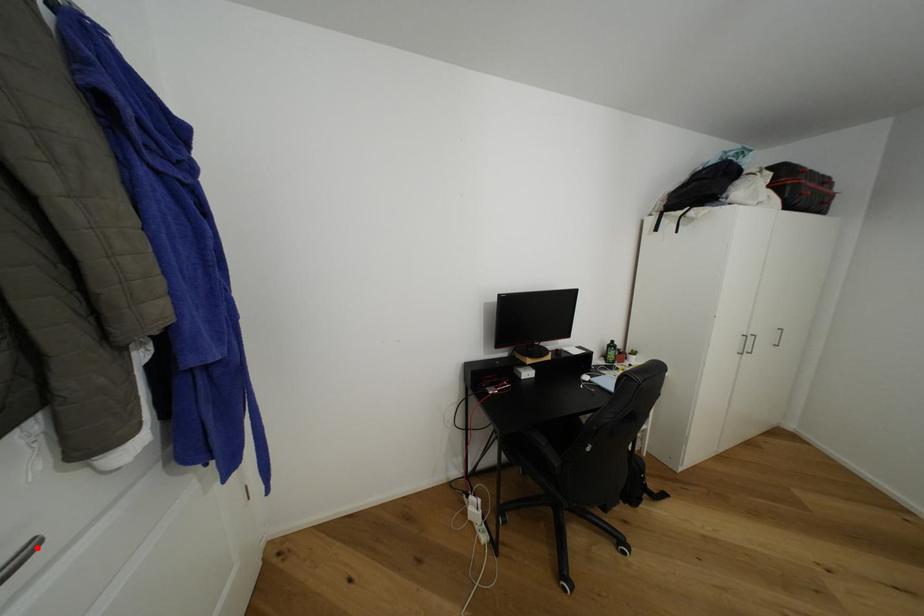
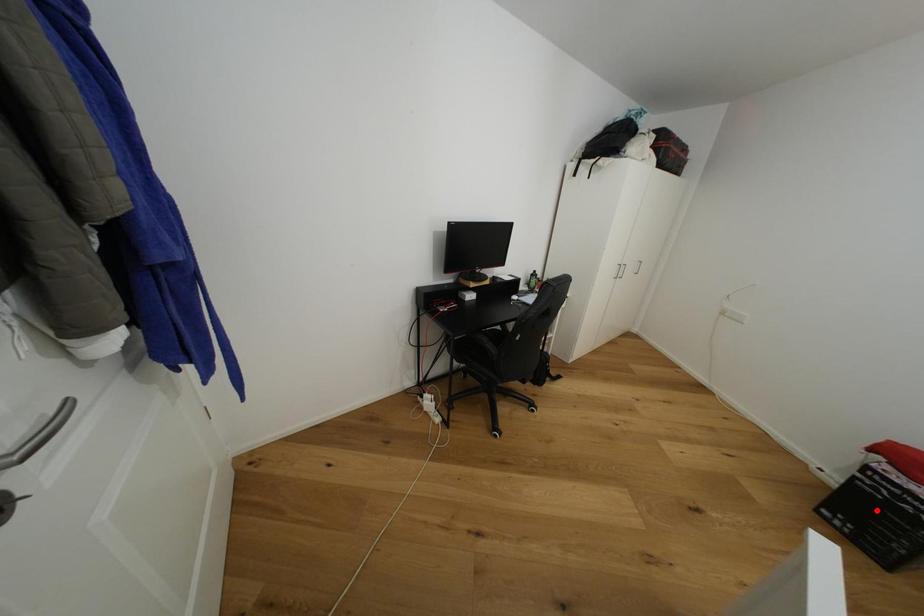
I am providing you with two images of the same scene from different viewpoints. A red point is marked on the first image and another point is marked on the second image. Is the red point in image1 aligned with the point shown in image2?

No